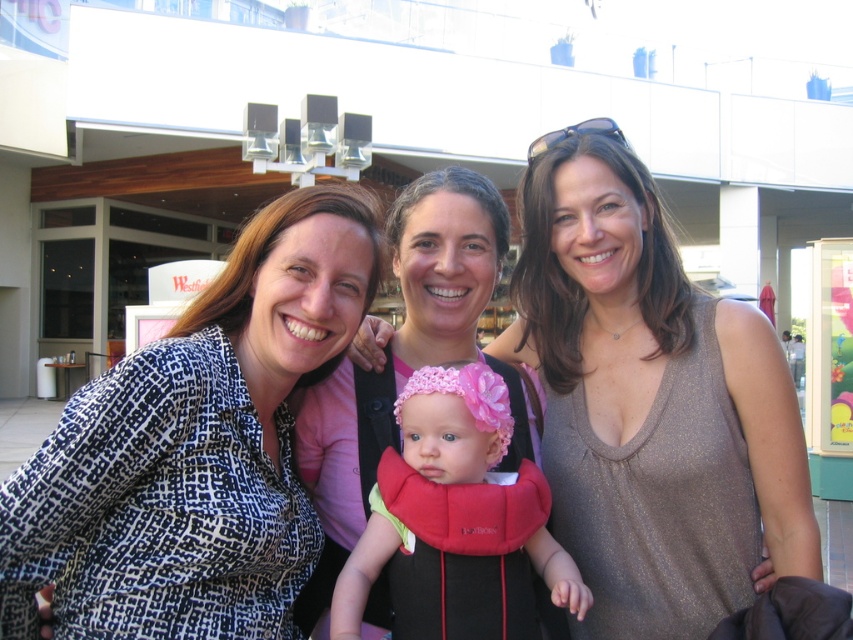
You are a photographer trying to capture a candid shot of the shiny gold tank top at center and the pink fabric baby carrier at center. Since you want to ensure both are in focus, you need to know their relative sizes. Which object is taller?

The shiny gold tank top at center is much taller as pink fabric baby carrier at center.

You are a photographer setting up for a group photo. You have a camera with a lens that can only focus on objects wider than 30 cm. Looking at the shiny gold tank top at center and the pink fabric baby carrier at center, which one will your camera focus on?

The shiny gold tank top at center is wider than the pink fabric baby carrier at center, so the camera will focus on the shiny gold tank top at center since it meets the minimum width requirement of 30 cm.

You are taking a photo of the shiny gold tank top at center and the pink knitted hat at center. Which object should you focus on first if you want to ensure both are in focus? Please explain your reasoning based on their positions.

The shiny gold tank top at center is much taller than the pink knitted hat at center. To ensure both are in focus, you should focus on the shiny gold tank top at center first since it is the taller object and likely farther away, allowing the depth of field to cover the closer pink knitted hat at center.